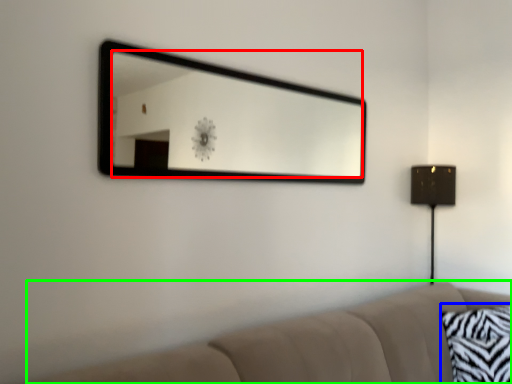
Question: Based on their relative distances, which object is nearer to mirror (highlighted by a red box)? Choose from pillow (highlighted by a blue box) and studio couch (highlighted by a green box).

Choices:
 (A) pillow
 (B) studio couch

Answer: (A)